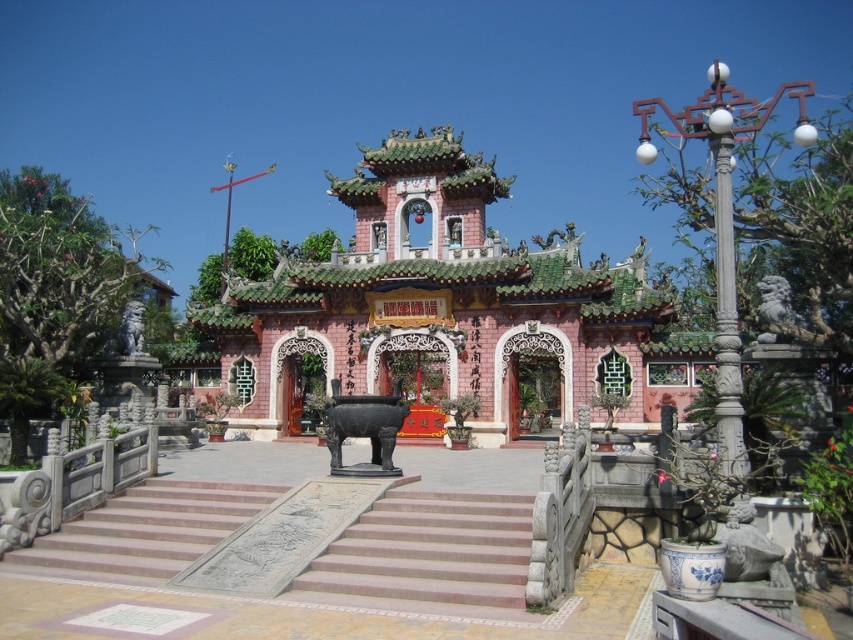
Is pink stone temple at center positioned behind smooth stone stairs at center?

Yes, pink stone temple at center is behind smooth stone stairs at center.

Does point (351, 321) come in front of point (366, 596)?

No, (351, 321) is further to viewer.

Locate an element on the screen. pink stone temple at center is located at coordinates (434, 301).

Is smooth stone stairs at center thinner than white carved stone pillar at right?

Indeed, smooth stone stairs at center has a lesser width compared to white carved stone pillar at right.

Is smooth stone stairs at center bigger than white carved stone pillar at right?

Actually, smooth stone stairs at center might be smaller than white carved stone pillar at right.

Who is more distant from viewer, (320, 598) or (730, 328)?

The point (320, 598) is more distant.

Locate an element on the screen. smooth stone stairs at center is located at coordinates (427, 556).

Measure the distance from white carved stone pillar at right to black polished elephant at center.

white carved stone pillar at right and black polished elephant at center are 78.64 feet apart from each other.

Based on the photo, does white carved stone pillar at right appear on the left side of black polished elephant at center?

In fact, white carved stone pillar at right is to the right of black polished elephant at center.

Where is `white carved stone pillar at right`? The image size is (853, 640). white carved stone pillar at right is located at coordinates (726, 317).